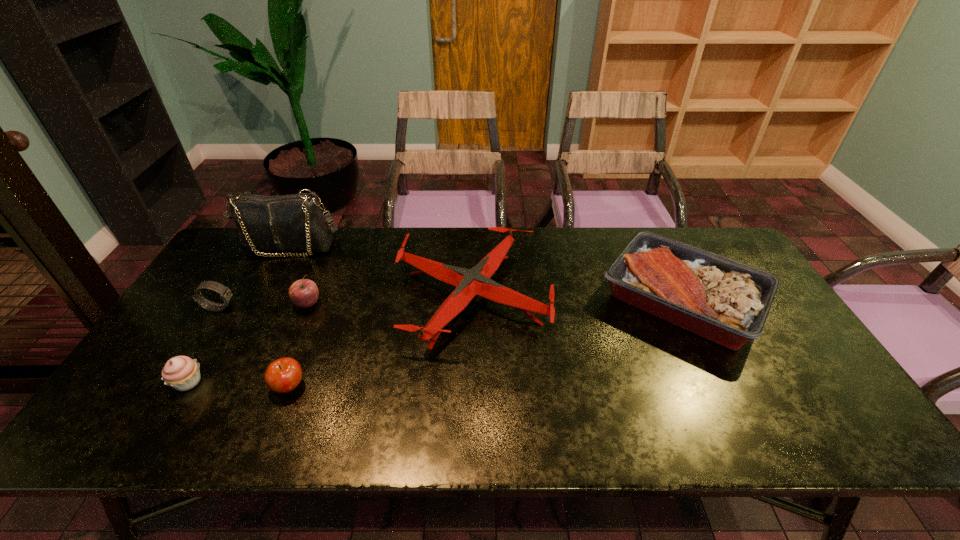
I want to click on object positioned at the right edge, so click(x=723, y=300).

Locate an element on the screen. object located at the far left corner is located at coordinates (294, 222).

Where is `object located at the far right corner`? object located at the far right corner is located at coordinates (723, 300).

Image resolution: width=960 pixels, height=540 pixels. Identify the location of blank area at the far edge. (575, 233).

Find the location of `free space at the near edge of the desktop`. free space at the near edge of the desktop is located at coordinates (691, 418).

The width and height of the screenshot is (960, 540). I want to click on free space at the left edge of the desktop, so click(141, 368).

Find the location of a particular element. This screenshot has height=540, width=960. vacant position at the far left corner of the desktop is located at coordinates (243, 267).

Locate an element on the screen. vacant region at the near right corner is located at coordinates (817, 420).

Identify the location of unoccupied position between the cupcake and the farther apple. This screenshot has height=540, width=960. (248, 343).

I want to click on vacant area that lies between the farther apple and the rightmost object, so click(x=494, y=302).